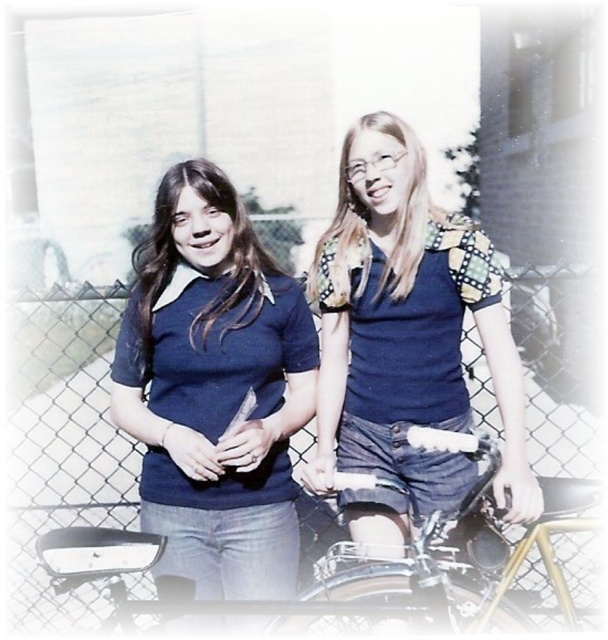
Looking at this image, you are standing at the point with coordinates point (199, 326) and want to walk towards the point with coordinates point (145, 442). According to the image, will you have to walk forward or backward to reach your destination?

Since point (145, 442) is in front of point (199, 326), you will have to walk forward to reach the destination.

What is the color of the clothing item located at the coordinates point [406,316] in the image?

The point [406,316] is on blue denim shorts at center, so the color is blue.